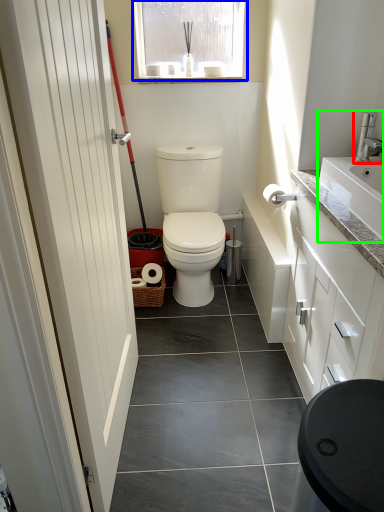
Question: Which object is the closest to the tap (highlighted by a red box)? Choose among these: window (highlighted by a blue box) or sink (highlighted by a green box).

Choices:
 (A) window
 (B) sink

Answer: (B)